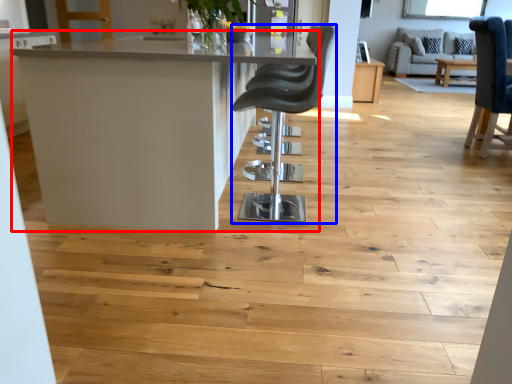
Question: Which object appears closest to the camera in this image, table (highlighted by a red box) or chair (highlighted by a blue box)?

Choices:
 (A) table
 (B) chair

Answer: (A)